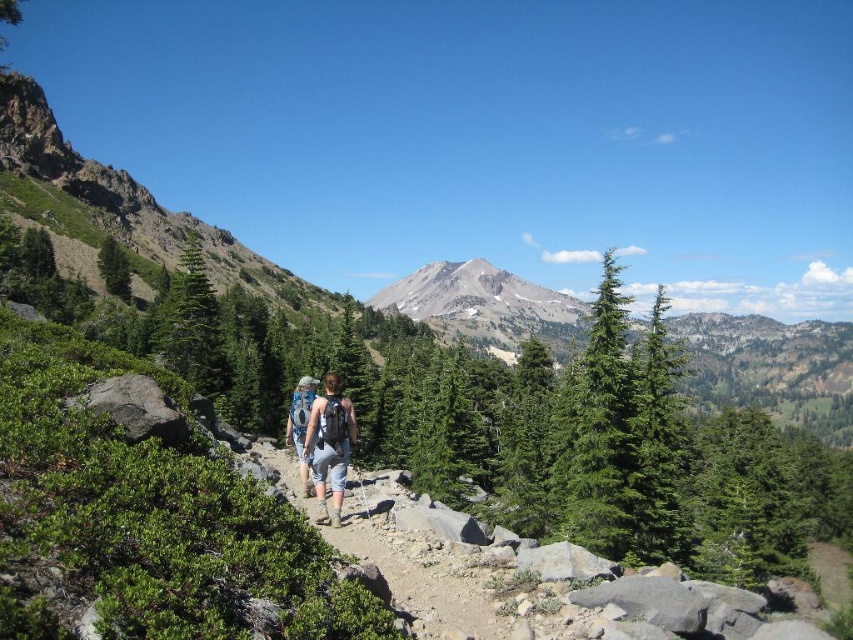
Question: Which object is positioned closest to the brown rocky trail at center?

Choices:
 (A) green textured evergreen tree at center
 (B) blue backpack at center
 (C) denim shorts at center
 (D) green matte evergreen tree at center-right

Answer: (C)

Question: Can you confirm if gray rocky peak at center is positioned to the right of green matte evergreen tree at center-right?

Choices:
 (A) no
 (B) yes

Answer: (B)

Question: Does green matte evergreen tree at center-right have a smaller size compared to blue backpack at center?

Choices:
 (A) yes
 (B) no

Answer: (B)

Question: Which point is closer to the camera taking this photo?

Choices:
 (A) (372, 387)
 (B) (309, 404)
 (C) (654, 401)
 (D) (344, 468)

Answer: (D)

Question: Which object is closer to the camera taking this photo?

Choices:
 (A) brown rocky trail at center
 (B) green leafy tree at center

Answer: (A)

Question: Is green textured evergreen tree at center wider than gray rocky peak at center?

Choices:
 (A) no
 (B) yes

Answer: (A)